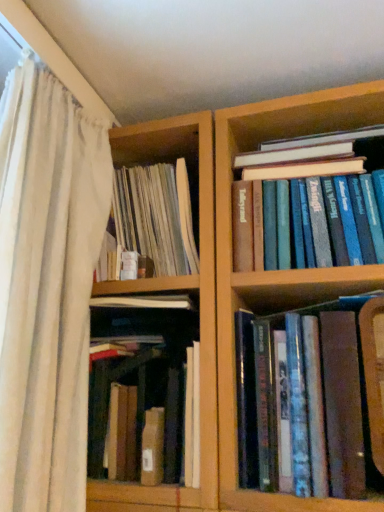
Question: Is white sheer curtain at left further to the viewer compared to blue hardcover books at upper right, marked as the first book in a right-to-left arrangement?

Choices:
 (A) yes
 (B) no

Answer: (B)

Question: Considering the relative sizes of white sheer curtain at left and blue hardcover books at upper right, which appears as the 3th book when viewed from the left, in the image provided, is white sheer curtain at left wider than blue hardcover books at upper right, which appears as the 3th book when viewed from the left,?

Choices:
 (A) yes
 (B) no

Answer: (B)

Question: From a real-world perspective, does white sheer curtain at left stand above blue hardcover books at upper right, which appears as the 3th book when viewed from the left?

Choices:
 (A) no
 (B) yes

Answer: (A)

Question: Is blue hardcover books at upper right, marked as the first book in a right-to-left arrangement, located within white sheer curtain at left?

Choices:
 (A) yes
 (B) no

Answer: (B)

Question: Does white sheer curtain at left appear on the left side of blue hardcover books at upper right, marked as the first book in a right-to-left arrangement?

Choices:
 (A) yes
 (B) no

Answer: (A)

Question: Can we say white sheer curtain at left lies outside blue hardcover books at upper right, marked as the first book in a right-to-left arrangement?

Choices:
 (A) no
 (B) yes

Answer: (B)

Question: Is brown cardboard box at center, which is the 3th book from right to left, aimed at brown leather book at lower right, the 2th book in the right-to-left sequence?

Choices:
 (A) no
 (B) yes

Answer: (A)

Question: Can you see brown cardboard box at center, the 1th book from the left, touching brown leather book at lower right, the 2th book in the right-to-left sequence?

Choices:
 (A) yes
 (B) no

Answer: (B)

Question: Is brown cardboard box at center, the 1th book from the left, positioned far away from brown leather book at lower right, the 2th book viewed from the left?

Choices:
 (A) no
 (B) yes

Answer: (A)

Question: Is brown cardboard box at center, the 1th book from the left, thinner than brown leather book at lower right, the 2th book viewed from the left?

Choices:
 (A) no
 (B) yes

Answer: (B)

Question: From the image's perspective, is brown cardboard box at center, the 1th book from the left, on top of brown leather book at lower right, the 2th book viewed from the left?

Choices:
 (A) no
 (B) yes

Answer: (A)

Question: Considering the relative sizes of brown cardboard box at center, which is the 3th book from right to left, and brown leather book at lower right, the 2th book viewed from the left, in the image provided, is brown cardboard box at center, which is the 3th book from right to left, bigger than brown leather book at lower right, the 2th book viewed from the left,?

Choices:
 (A) yes
 (B) no

Answer: (A)

Question: Does blue hardcover books at upper right, marked as the first book in a right-to-left arrangement, have a greater height compared to brown cardboard box at center, the 1th book from the left?

Choices:
 (A) no
 (B) yes

Answer: (A)